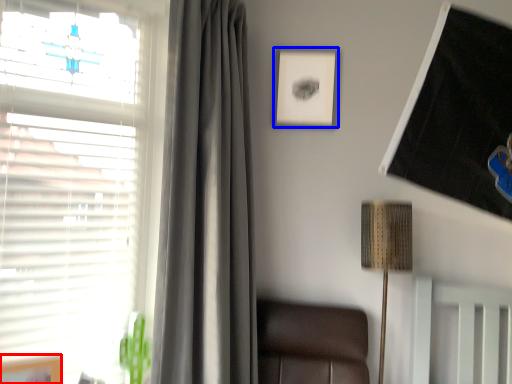
Question: Which of the following is the closest to the observer, picture frame (highlighted by a red box) or picture frame (highlighted by a blue box)?

Choices:
 (A) picture frame
 (B) picture frame

Answer: (A)